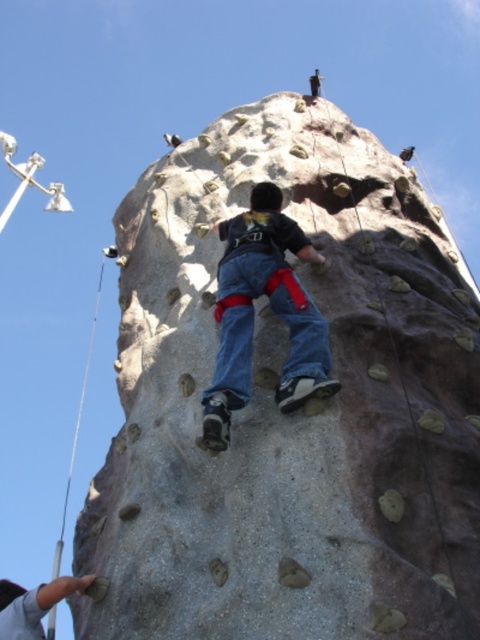
You are a photographer trying to capture the child climbing the rock wall. You notice the gray rough climbing rock at center and the denim jeans at center. Which object is wider in the image?

The gray rough climbing rock at center is wider than the denim jeans at center.

You are standing 40 meters away from a rock climbing wall. A point on the wall at coordinates point (164, 564) is where you want to place a new hold. According to the image, is this point closer to you or farther than your current distance?

The distance of point (164, 564) from viewer is 39.83 meters, which is slightly closer than your current 40 meters distance. Therefore, the point is closer to you.

You are standing 30 meters away from a gray rough climbing rock at center. If you want to reach it, will you have to walk forward or backward?

The gray rough climbing rock at center is 33.23 meters away from the viewer. Since you are currently 30 meters away, you need to walk forward an additional 3.23 meters to reach it.